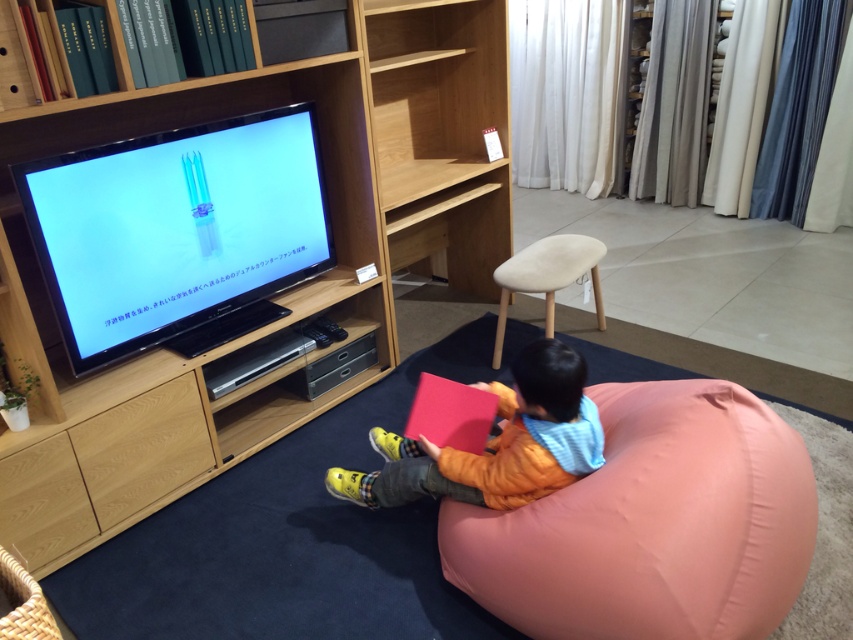
Is point (527, 556) in front of point (552, 264)?

Yes.

Locate an element on the screen. pink fabric bean bag at lower center is located at coordinates (x=653, y=524).

Can you confirm if orange fabric bean bag at lower center is positioned to the left of beige fabric stool at upper right?

Correct, you'll find orange fabric bean bag at lower center to the left of beige fabric stool at upper right.

Can you confirm if orange fabric bean bag at lower center is bigger than beige fabric stool at upper right?

Yes, orange fabric bean bag at lower center is bigger than beige fabric stool at upper right.

Is point (485, 449) farther from viewer compared to point (544, 280)?

No, it is in front of (544, 280).

I want to click on orange fabric bean bag at lower center, so click(494, 444).

Between wooden entertainment center at left and beige fabric stool at upper right, which one has less height?

beige fabric stool at upper right

Can you confirm if wooden entertainment center at left is smaller than beige fabric stool at upper right?

No.

Which is behind, point (152, 122) or point (592, 253)?

Positioned behind is point (592, 253).

The image size is (853, 640). I want to click on wooden entertainment center at left, so click(x=280, y=292).